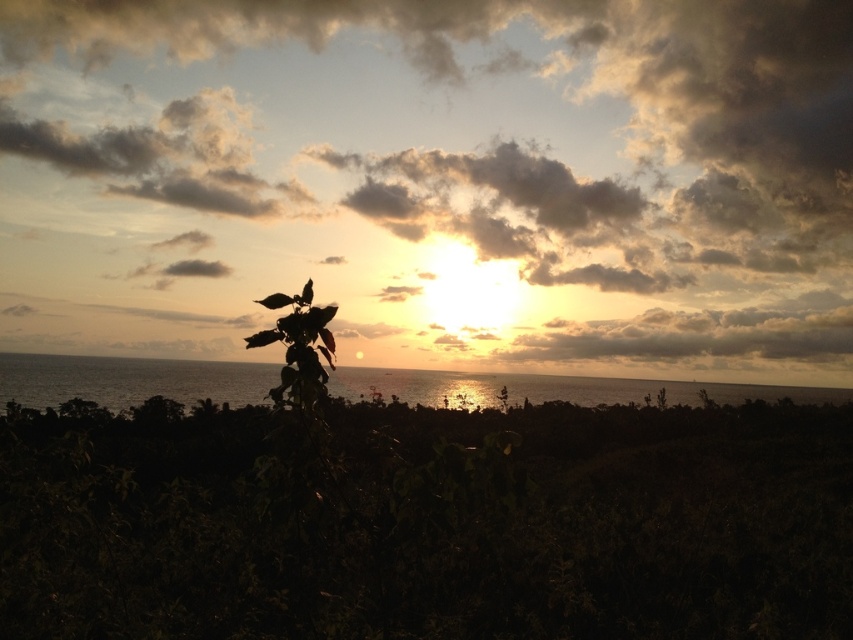
Does point (759, 298) come closer to viewer compared to point (300, 403)?

That is False.

Which is more to the right, cloudy sky at upper center or green leafy plant at center-left?

Positioned to the right is green leafy plant at center-left.

What do you see at coordinates (434, 179) in the screenshot?
I see `cloudy sky at upper center` at bounding box center [434, 179].

At what (x,y) coordinates should I click in order to perform the action: click on cloudy sky at upper center. Please return your answer as a coordinate pair (x, y). Looking at the image, I should click on (434, 179).

Between shiny metallic water at center and green leafy plant at center-left, which one has less height?

green leafy plant at center-left is shorter.

Which is in front, point (596, 385) or point (315, 307)?

Point (315, 307) is more forward.

Does point (560, 392) come closer to viewer compared to point (282, 369)?

No.

The width and height of the screenshot is (853, 640). I want to click on shiny metallic water at center, so click(x=554, y=388).

Is cloudy sky at upper center to the left of shiny metallic water at center from the viewer's perspective?

Yes, cloudy sky at upper center is to the left of shiny metallic water at center.

Does point (531, 152) come behind point (587, 387)?

Yes, point (531, 152) is behind point (587, 387).

Identify the location of cloudy sky at upper center. The image size is (853, 640). (434, 179).